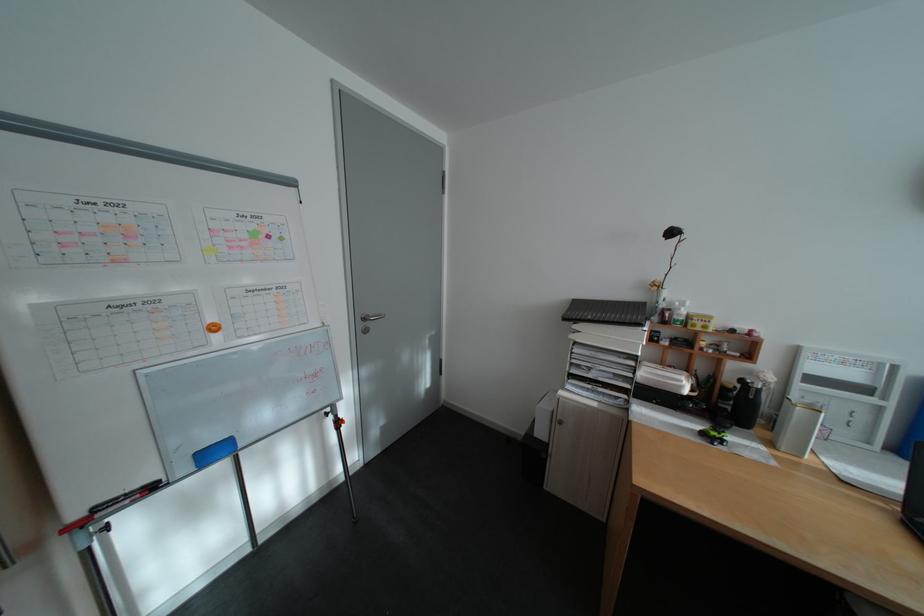
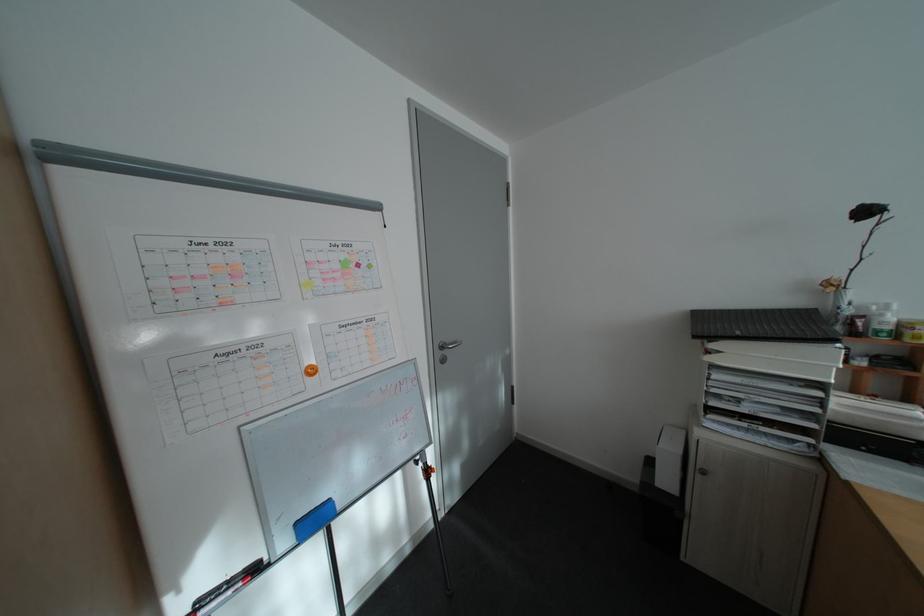
Question: The camera is either moving clockwise (left) or counter-clockwise (right) around the object. The first image is from the beginning of the video and the second image is from the end. Is the camera moving left or right when shooting the video?

Choices:
 (A) Left
 (B) Right

Answer: (B)